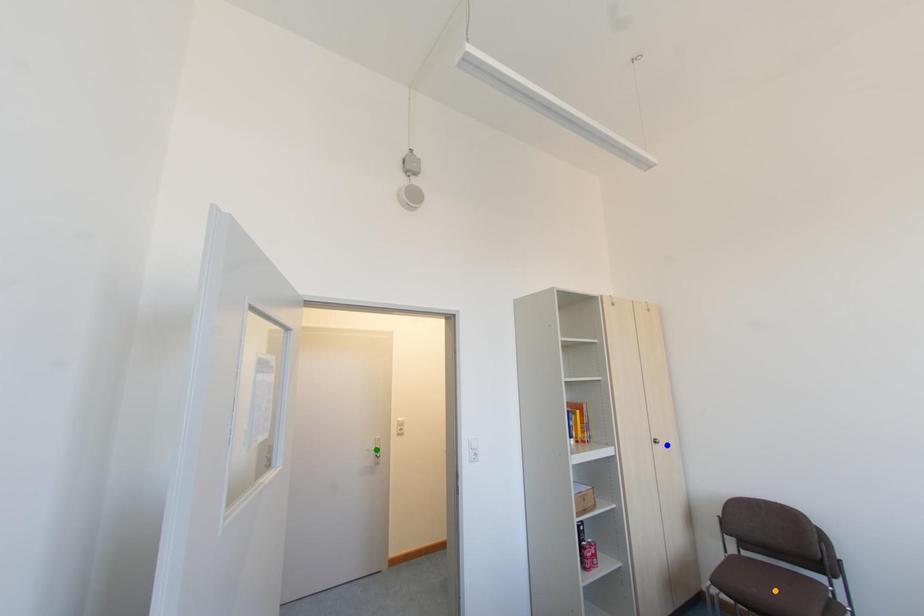
Order these from nearest to farthest:
green point | orange point | blue point

green point, blue point, orange point